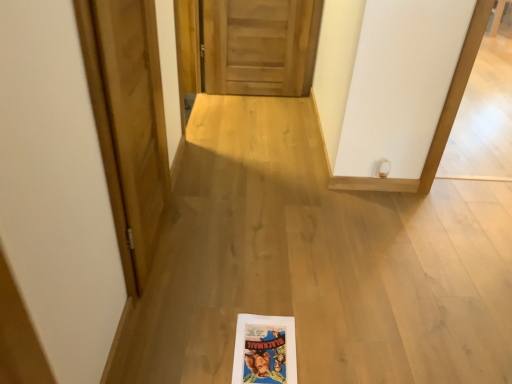
Question: Are wooden at center, which is the second door from left to right, and wooden door at left, which is counted as the second door, starting from the back, located far from each other?

Choices:
 (A) yes
 (B) no

Answer: (A)

Question: From the image's perspective, is wooden at center, which ranks as the first door in top-to-bottom order, over wooden door at left, the second door viewed from the right?

Choices:
 (A) yes
 (B) no

Answer: (A)

Question: Can you confirm if wooden at center, which ranks as the first door in top-to-bottom order, is bigger than wooden door at left, which is counted as the second door, starting from the back?

Choices:
 (A) yes
 (B) no

Answer: (A)

Question: Can you confirm if wooden at center, which ranks as the first door in top-to-bottom order, is taller than wooden door at left, which ranks as the first door in bottom-to-top order?

Choices:
 (A) yes
 (B) no

Answer: (B)

Question: Is wooden at center, which ranks as the first door in top-to-bottom order, at the left side of wooden door at left, the 2th door in the top-to-bottom sequence?

Choices:
 (A) yes
 (B) no

Answer: (B)

Question: Does wooden at center, which is counted as the 1th door, starting from the right, lie behind wooden door at left, which is counted as the second door, starting from the back?

Choices:
 (A) yes
 (B) no

Answer: (A)

Question: From a real-world perspective, is wooden door at left, the 2th door in the top-to-bottom sequence, on wooden at center, the 2th door positioned from the front?

Choices:
 (A) no
 (B) yes

Answer: (B)

Question: From a real-world perspective, is wooden door at left, which is counted as the second door, starting from the back, physically below wooden at center, the 2th door when ordered from bottom to top?

Choices:
 (A) yes
 (B) no

Answer: (B)

Question: Is wooden door at left, which ranks as the first door in bottom-to-top order, taller than wooden at center, which ranks as the first door in top-to-bottom order?

Choices:
 (A) yes
 (B) no

Answer: (A)

Question: Can you confirm if wooden door at left, the 2th door in the top-to-bottom sequence, is bigger than wooden at center, which is the second door from left to right?

Choices:
 (A) no
 (B) yes

Answer: (A)

Question: Is wooden at center, the 2th door positioned from the front, a part of wooden door at left, which is counted as the second door, starting from the back?

Choices:
 (A) yes
 (B) no

Answer: (B)

Question: Considering the relative sizes of wooden door at left, which ranks as the first door in left-to-right order, and wooden at center, the 2th door positioned from the front, in the image provided, is wooden door at left, which ranks as the first door in left-to-right order, shorter than wooden at center, the 2th door positioned from the front,?

Choices:
 (A) no
 (B) yes

Answer: (A)

Question: Relative to wooden door at left, acting as the 1th door starting from the front, is wooden at center, which is counted as the 1th door, starting from the right, in front or behind?

Choices:
 (A) front
 (B) behind

Answer: (B)